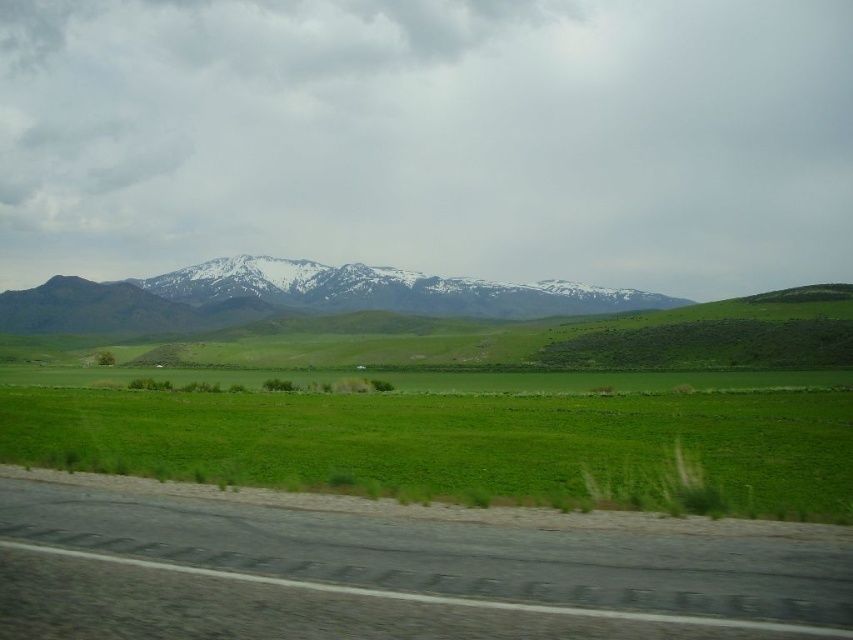
Question: Which point is farther from the camera taking this photo?

Choices:
 (A) (387, 276)
 (B) (263, 529)
 (C) (366, 432)

Answer: (A)

Question: Is green grass at lower center further to the viewer compared to snow-covered mountain range at upper center?

Choices:
 (A) no
 (B) yes

Answer: (A)

Question: Based on their relative distances, which object is nearer to the snow-covered mountain range at upper center?

Choices:
 (A) green grass at lower center
 (B) black asphalt road at lower left

Answer: (A)

Question: Which of the following is the closest to the observer?

Choices:
 (A) (120, 426)
 (B) (663, 554)

Answer: (B)

Question: Considering the relative positions of black asphalt road at lower left and green grass at lower center in the image provided, where is black asphalt road at lower left located with respect to green grass at lower center?

Choices:
 (A) right
 (B) left

Answer: (B)

Question: Is black asphalt road at lower left positioned before green grass at lower center?

Choices:
 (A) yes
 (B) no

Answer: (A)